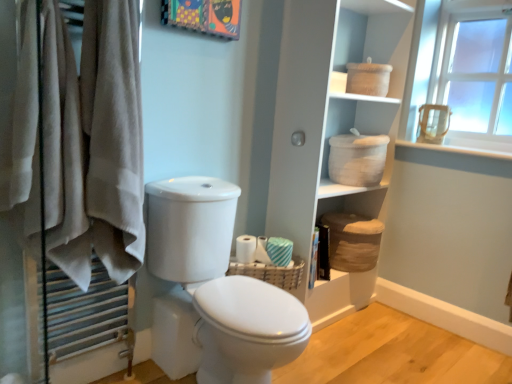
You are a GUI agent. You are given a task and a screenshot of the screen. Output one action in this format:
    pyautogui.click(x=<x>, y=<y>)
    Task: Click on the vacant space to the right of white glossy toilet at center
    The height and width of the screenshot is (384, 512).
    Given the screenshot: What is the action you would take?
    pyautogui.click(x=336, y=352)